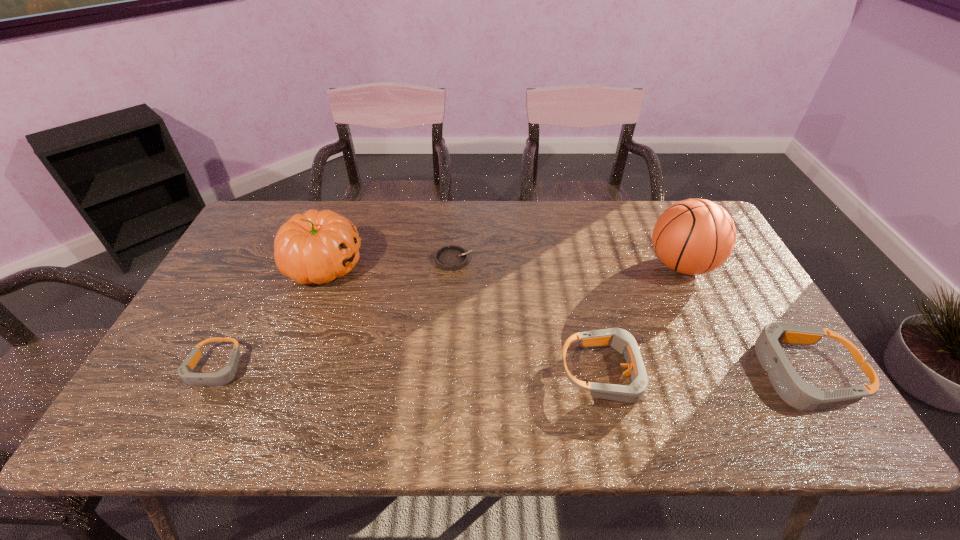
I want to click on free location located on the front and back of the rightmost goggles, so click(591, 374).

At what (x,y) coordinates should I click in order to perform the action: click on free space located 0.150m on the front and back of the rightmost goggles. Please return your answer as a coordinate pair (x, y). This screenshot has height=540, width=960. Looking at the image, I should click on (687, 374).

I want to click on vacant space situated 0.390m on the front and back of the rightmost goggles, so click(x=587, y=374).

At what (x,y) coordinates should I click in order to perform the action: click on free space located 0.270m on the left of the third object from left to right. Please return your answer as a coordinate pair (x, y). Looking at the image, I should click on (347, 260).

You are a GUI agent. You are given a task and a screenshot of the screen. Output one action in this format:
    pyautogui.click(x=<x>, y=<y>)
    Task: Click on the free spot located 0.160m on the carved face of the fifth shortest object
    Image resolution: width=960 pixels, height=540 pixels.
    Given the screenshot: What is the action you would take?
    pyautogui.click(x=418, y=265)

This screenshot has height=540, width=960. What are the coordinates of `free point located on the front of the basketball` in the screenshot? It's located at (709, 323).

Locate an element on the screen. The width and height of the screenshot is (960, 540). pumpkin situated at the far edge is located at coordinates (316, 247).

Image resolution: width=960 pixels, height=540 pixels. I want to click on basketball located in the far edge section of the desktop, so click(695, 236).

What are the coordinates of `object situated at the left edge` in the screenshot? It's located at (225, 375).

Where is `goggles present at the right edge`? goggles present at the right edge is located at coordinates (795, 391).